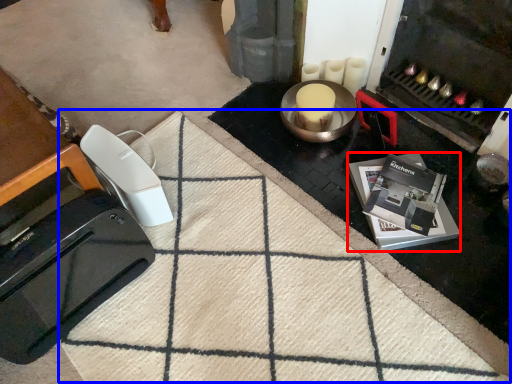
Question: Among these objects, which one is nearest to the camera, appliance (highlighted by a red box) or doormat (highlighted by a blue box)?

Choices:
 (A) appliance
 (B) doormat

Answer: (B)